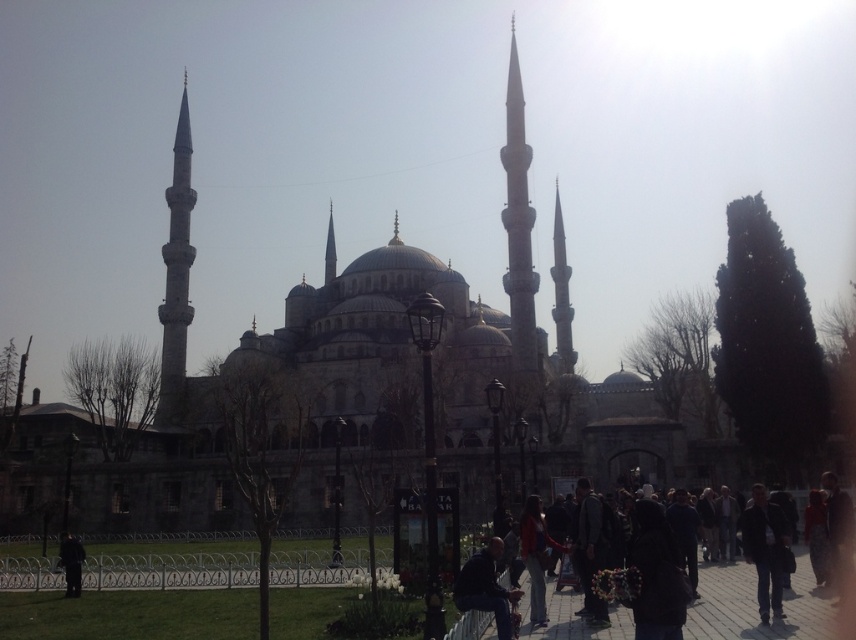
Who is positioned more to the right, dark red jacket at lower center or black fabric coat at lower left?

dark red jacket at lower center is more to the right.

What do you see at coordinates (756, 605) in the screenshot? The width and height of the screenshot is (856, 640). I see `dark red jacket at lower center` at bounding box center [756, 605].

This screenshot has height=640, width=856. What are the coordinates of `dark red jacket at lower center` in the screenshot? It's located at (756, 605).

Measure the distance between dark red jacket at lower center and camera.

The distance of dark red jacket at lower center from camera is 77.34 meters.

Is point (740, 612) more distant than point (177, 170)?

No, (740, 612) is in front of (177, 170).

Describe the element at coordinates (756, 605) in the screenshot. I see `dark red jacket at lower center` at that location.

Identify the location of dark red jacket at lower center. The image size is (856, 640). (756, 605).

Does dark red jacket at lower center appear under dark blue jeans at lower center?

Yes.

Can you confirm if dark red jacket at lower center is thinner than dark blue jeans at lower center?

Incorrect, dark red jacket at lower center's width is not less than dark blue jeans at lower center's.

Describe the element at coordinates (756, 605) in the screenshot. I see `dark red jacket at lower center` at that location.

The width and height of the screenshot is (856, 640). I want to click on dark red jacket at lower center, so click(x=756, y=605).